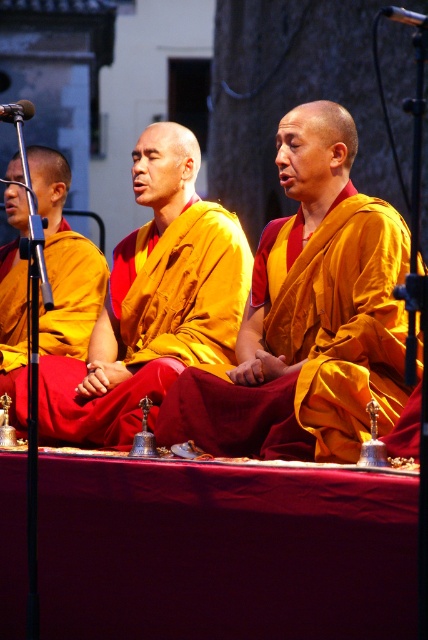
You are a photographer positioned behind the stage. You need to capture a photo where both the matte gold robe at left and the metallic microphone at left are clearly visible. Based on their positions, will the microphone block the view of the robe?

The matte gold robe at left is below the metallic microphone at left, so the microphone will block part of the robe in the photo.

You are a photographer standing at the back of the stage, and you want to take a photo of both the burgundy fabric tablecloth at center and the shiny gold robe at center in the same frame. Given that your camera has a maximum focus range of 10 meters, will you be able to capture both objects clearly in one shot?

The distance between the burgundy fabric tablecloth at center and the shiny gold robe at center is 10.98 meters, which exceeds the camera maximum focus range of 10 meters. Therefore, you cannot capture both objects clearly in one shot.

You are a photographer positioned in front of the stage. You want to capture a photo where the shiny gold robe at center is clearly visible without being blocked by the burgundy fabric tablecloth at center. Based on their positions, is this possible?

The shiny gold robe at center is behind the burgundy fabric tablecloth at center, so it would be blocked and not visible in the photo unless the tablecloth is moved or the angle is adjusted.